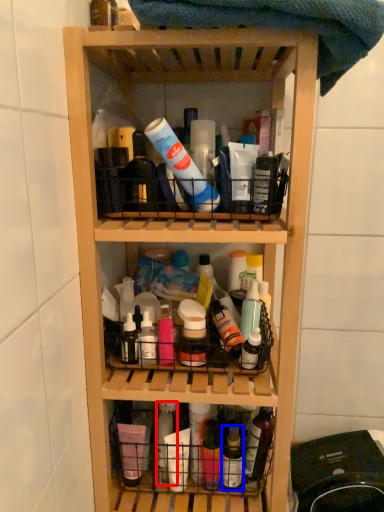
Question: Among these objects, which one is nearest to the camera, bottle (highlighted by a red box) or bottle (highlighted by a blue box)?

Choices:
 (A) bottle
 (B) bottle

Answer: (A)